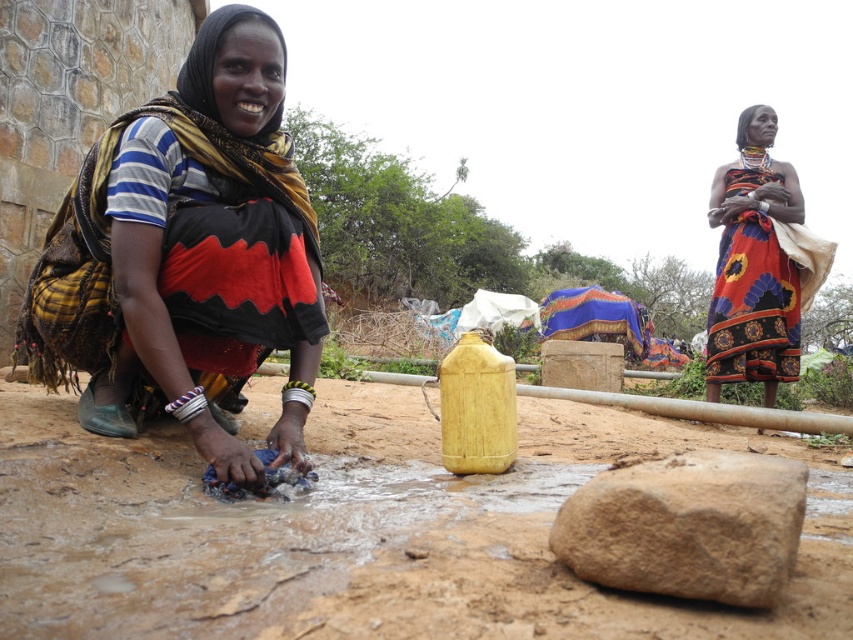
Question: Which object is closer to the camera taking this photo?

Choices:
 (A) matte black fabric at lower left
 (B) floral fabric dress at upper right
 (C) brown rough rock at lower center
 (D) dull brown dirt at center

Answer: (D)

Question: Considering the relative positions of dull brown dirt at center and matte black fabric at lower left in the image provided, where is dull brown dirt at center located with respect to matte black fabric at lower left?

Choices:
 (A) left
 (B) right

Answer: (B)

Question: Is brown rough rock at lower center to the right of floral fabric dress at upper right from the viewer's perspective?

Choices:
 (A) yes
 (B) no

Answer: (B)

Question: Which object appears closest to the camera in this image?

Choices:
 (A) matte black fabric at lower left
 (B) brown rough rock at lower center
 (C) dull brown dirt at center

Answer: (C)

Question: Does matte black fabric at lower left appear over brown rough rock at lower center?

Choices:
 (A) yes
 (B) no

Answer: (A)

Question: Which object is closer to the camera taking this photo?

Choices:
 (A) matte black fabric at lower left
 (B) floral fabric dress at upper right

Answer: (A)